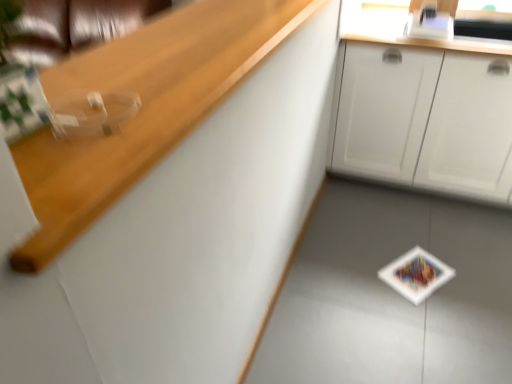
The height and width of the screenshot is (384, 512). What do you see at coordinates (142, 108) in the screenshot?
I see `wooden at upper left` at bounding box center [142, 108].

Where is `wooden at upper left`? The image size is (512, 384). wooden at upper left is located at coordinates (142, 108).

Locate an element on the screen. white matte cabinet at upper right is located at coordinates [x=423, y=114].

What do you see at coordinates (423, 114) in the screenshot?
I see `white matte cabinet at upper right` at bounding box center [423, 114].

Measure the distance between point (358, 130) and camera.

Point (358, 130) and camera are 7.59 feet apart from each other.

The image size is (512, 384). Identify the location of wooden at upper left. (142, 108).

Between wooden at upper left and white matte cabinet at upper right, which one appears on the left side from the viewer's perspective?

wooden at upper left is more to the left.

Is the depth of wooden at upper left greater than that of white matte cabinet at upper right?

No, wooden at upper left is closer to the viewer.

Considering the points (87, 53) and (340, 156), which point is behind, point (87, 53) or point (340, 156)?

Point (87, 53)

From the image's perspective, which one is positioned higher, wooden at upper left or white matte cabinet at upper right?

white matte cabinet at upper right, from the image's perspective.

From a real-world perspective, is wooden at upper left over white matte cabinet at upper right?

Indeed, from a real-world perspective, wooden at upper left stands above white matte cabinet at upper right.

Which of these two, wooden at upper left or white matte cabinet at upper right, is wider?

white matte cabinet at upper right.

Between wooden at upper left and white matte cabinet at upper right, which one has more height?

With more height is white matte cabinet at upper right.

Based on the photo, can you confirm if wooden at upper left is smaller than white matte cabinet at upper right?

Correct, wooden at upper left occupies less space than white matte cabinet at upper right.

Is white matte cabinet at upper right located within wooden at upper left?

No.

Is wooden at upper left next to white matte cabinet at upper right?

No.

Is wooden at upper left oriented towards white matte cabinet at upper right?

No, wooden at upper left is not turned towards white matte cabinet at upper right.

Consider the image. Measure the distance between wooden at upper left and white matte cabinet at upper right.

wooden at upper left and white matte cabinet at upper right are 3.70 feet apart.

The height and width of the screenshot is (384, 512). What are the coordinates of `cabinetry that appears behind the wooden at upper left` in the screenshot? It's located at (423, 114).

From the picture: Which is more to the left, white matte cabinet at upper right or wooden at upper left?

From the viewer's perspective, wooden at upper left appears more on the left side.

Considering the relative positions of white matte cabinet at upper right and wooden at upper left in the image provided, is white matte cabinet at upper right in front of wooden at upper left?

No, white matte cabinet at upper right is further to the viewer.

Is point (406, 93) closer or farther from the camera than point (278, 8)?

Clearly, point (406, 93) is more distant from the camera than point (278, 8).

From the image's perspective, is white matte cabinet at upper right above wooden at upper left?

Indeed, from the image's perspective, white matte cabinet at upper right is shown above wooden at upper left.

From a real-world perspective, relative to wooden at upper left, is white matte cabinet at upper right vertically above or below?

Clearly, from a real-world perspective, white matte cabinet at upper right is below wooden at upper left.

Considering the sizes of objects white matte cabinet at upper right and wooden at upper left in the image provided, who is wider, white matte cabinet at upper right or wooden at upper left?

Wider between the two is white matte cabinet at upper right.

Considering the sizes of objects white matte cabinet at upper right and wooden at upper left in the image provided, who is taller, white matte cabinet at upper right or wooden at upper left?

With more height is white matte cabinet at upper right.

Between white matte cabinet at upper right and wooden at upper left, which one has smaller size?

Smaller between the two is wooden at upper left.

Is wooden at upper left inside white matte cabinet at upper right?

No, white matte cabinet at upper right does not contain wooden at upper left.

Are white matte cabinet at upper right and wooden at upper left far apart?

That's right, there is a large distance between white matte cabinet at upper right and wooden at upper left.

Is white matte cabinet at upper right facing away from wooden at upper left?

No, white matte cabinet at upper right's orientation is not away from wooden at upper left.

Can you tell me how much white matte cabinet at upper right and wooden at upper left differ in facing direction?

89.4 degrees.

You are a GUI agent. You are given a task and a screenshot of the screen. Output one action in this format:
    pyautogui.click(x=<x>, y=<y>)
    Task: Click on the counter top that is above the white matte cabinet at upper right (from a real-world perspective)
    
    Given the screenshot: What is the action you would take?
    pyautogui.click(x=142, y=108)

At what (x,y) coordinates should I click in order to perform the action: click on cabinetry that appears below the wooden at upper left (from a real-world perspective). Please return your answer as a coordinate pair (x, y). Looking at the image, I should click on (423, 114).

Identify the location of cabinetry on the right side of wooden at upper left. (423, 114).